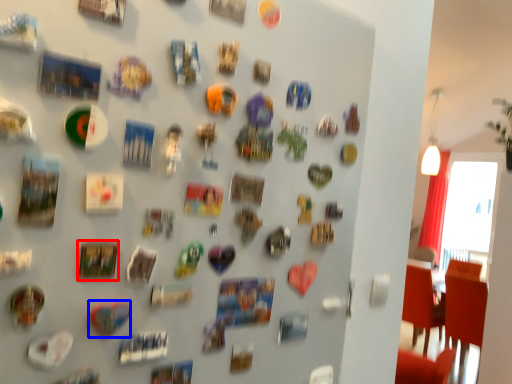
Question: Which of the following is the farthest to the observer, art (highlighted by a red box) or art (highlighted by a blue box)?

Choices:
 (A) art
 (B) art

Answer: (B)